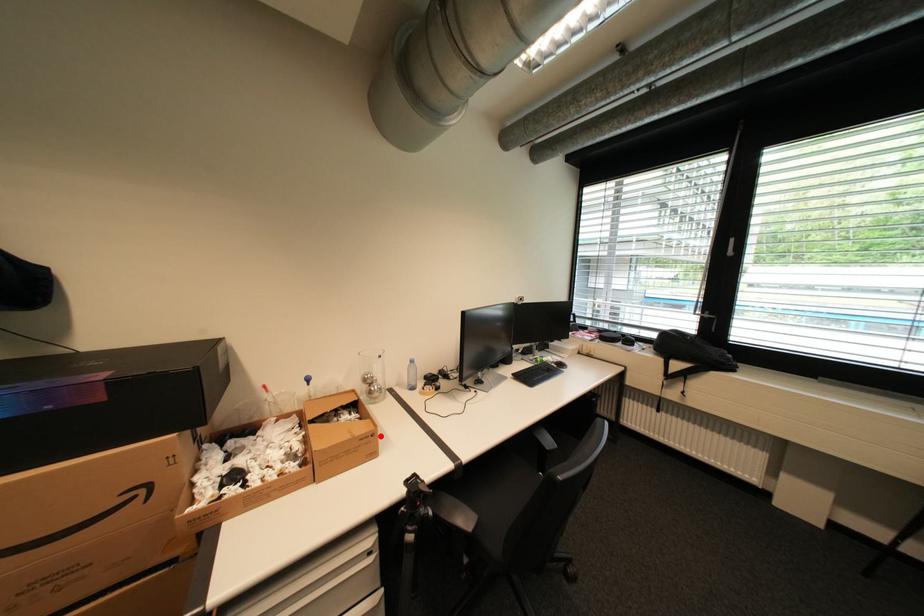
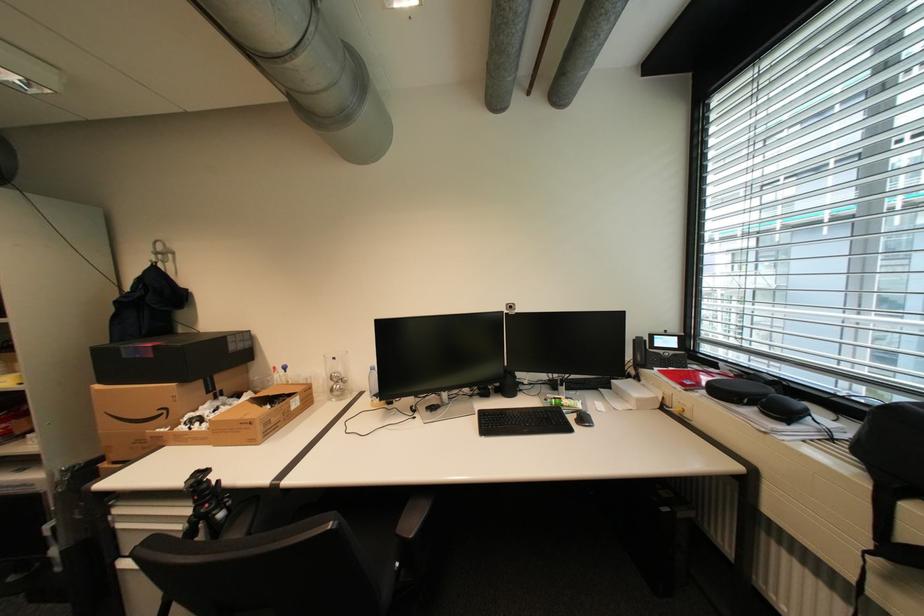
Where in the second image is the point corresponding to the highlighted location from the first image?

(259, 424)